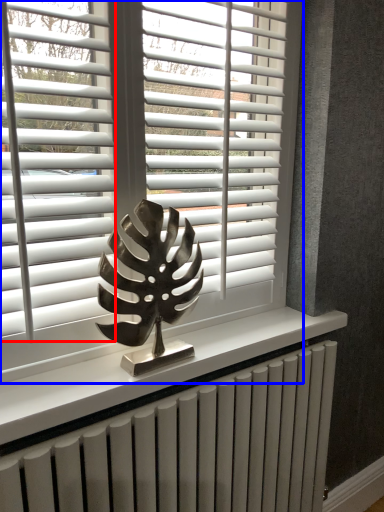
Question: Which point is further to the camera, blind (highlighted by a red box) or window blind (highlighted by a blue box)?

Choices:
 (A) blind
 (B) window blind

Answer: (A)